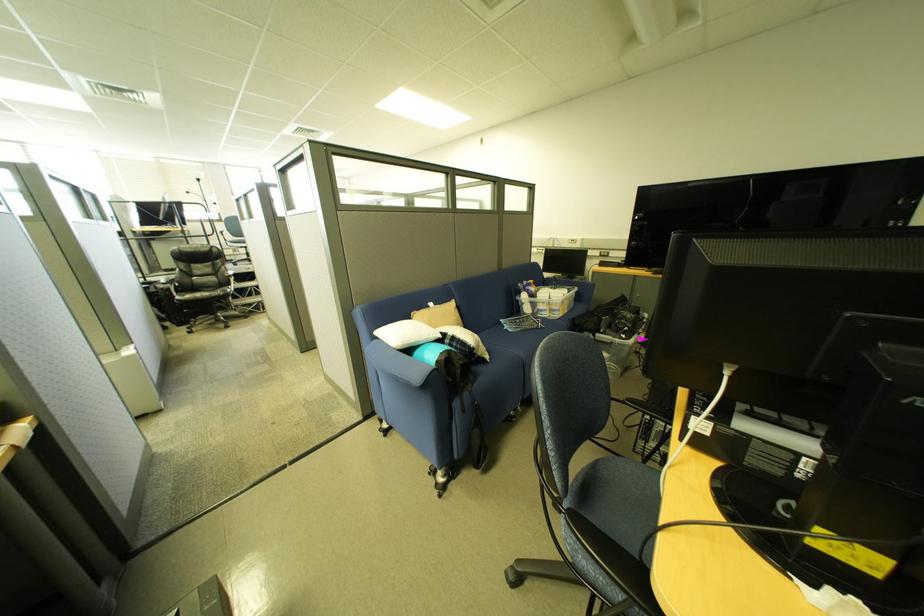
Identify the location of black bag strap. This screenshot has width=924, height=616. (477, 432).